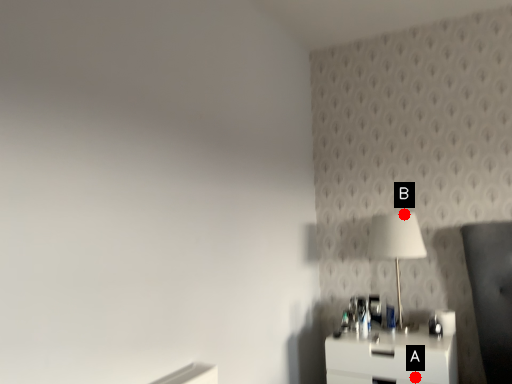
Question: Two points are circled on the image, labeled by A and B beside each circle. Which point is closer to the camera?

Choices:
 (A) A is closer
 (B) B is closer

Answer: (A)